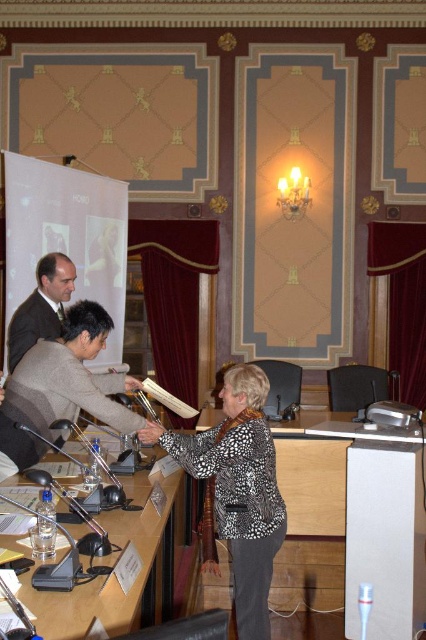
You are standing in the conference room and need to place a new laptop on the clear plastic table at center. According to the image, where exactly should you place the laptop?

The clear plastic table at center is located at point coordinates of [140,568], so place the laptop there.